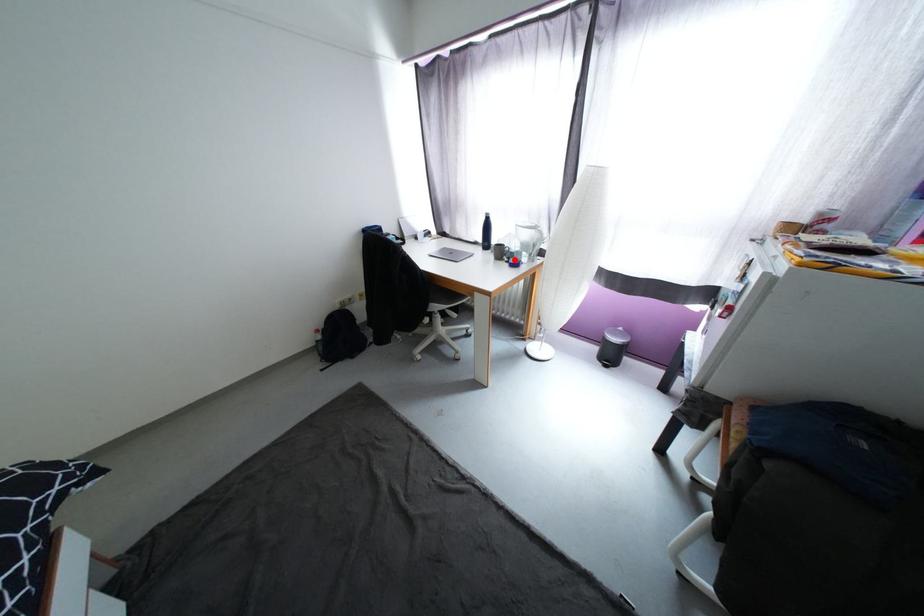
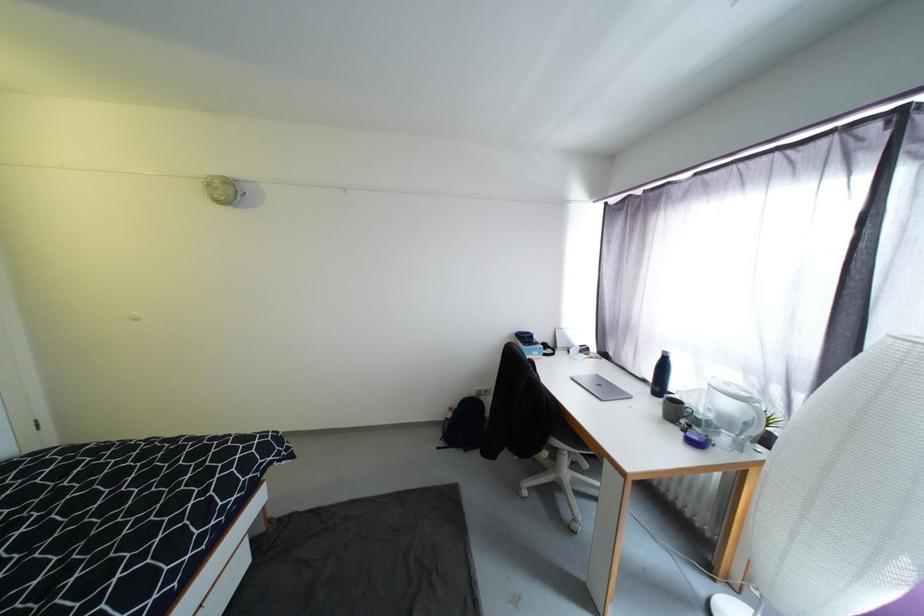
Question: I am providing you with two images of the same scene from different viewpoints. A red point is marked on the first image. Can you still see the location of the red point in image 2?

Choices:
 (A) Yes
 (B) No

Answer: (A)